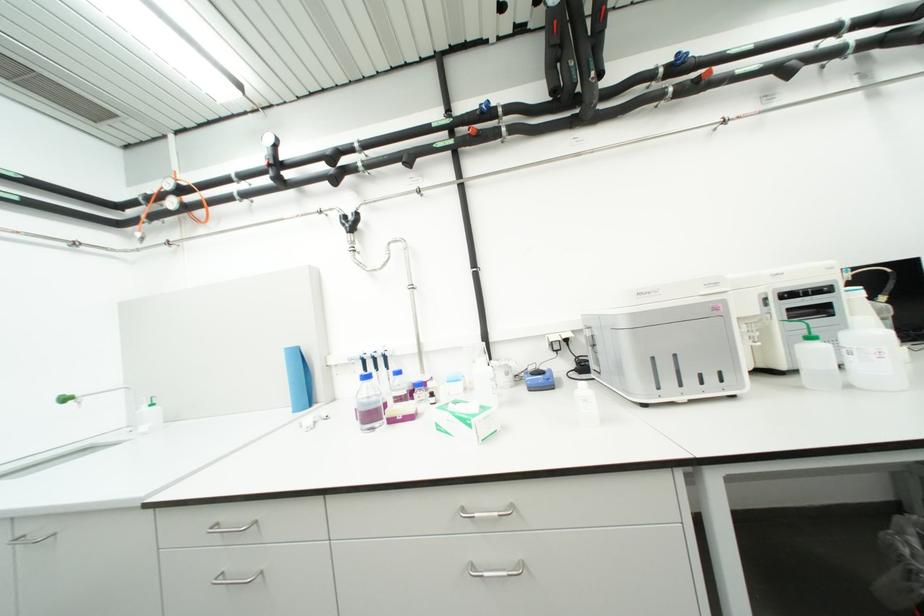
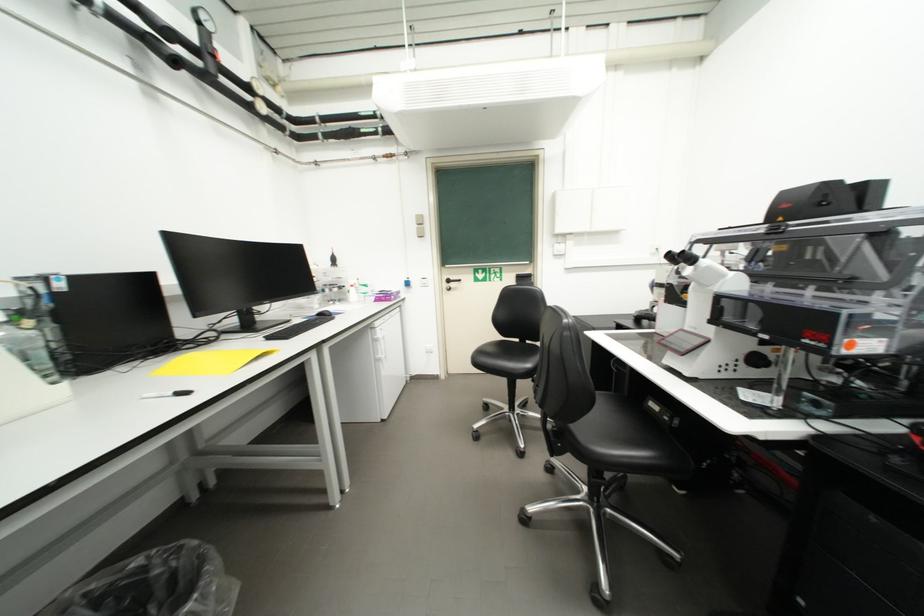
Question: Based on the continuous images, in which direction is the camera rotating? Reply with the corresponding letter.

Choices:
 (A) Left
 (B) Right
 (C) Up
 (D) Down

Answer: (B)